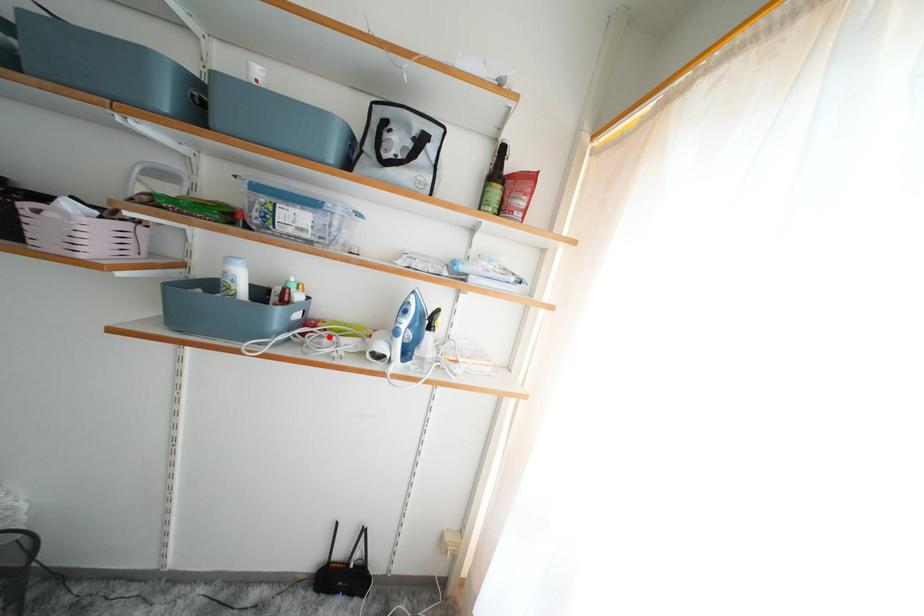
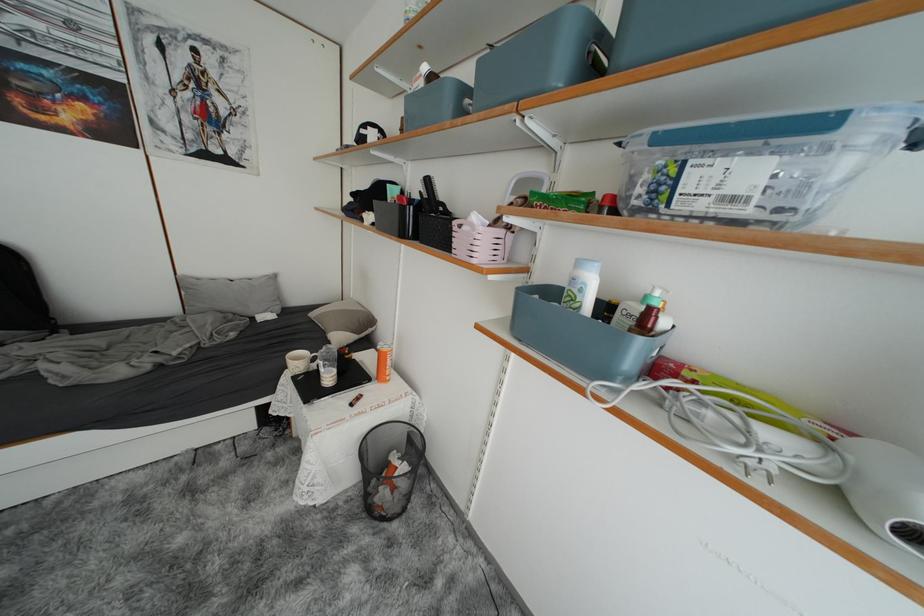
Find the pixel in the second image that matches the highlighted location in the first image.

(713, 402)